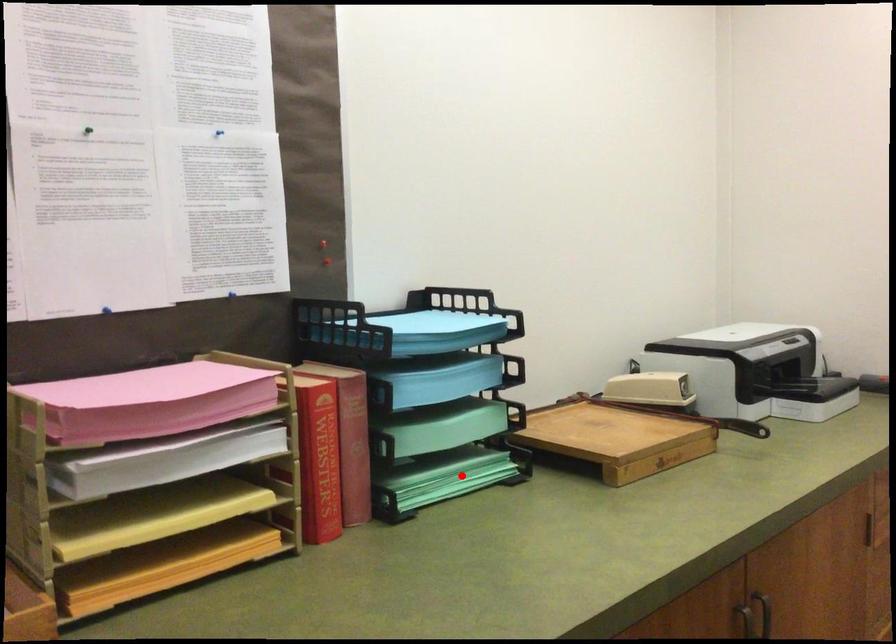
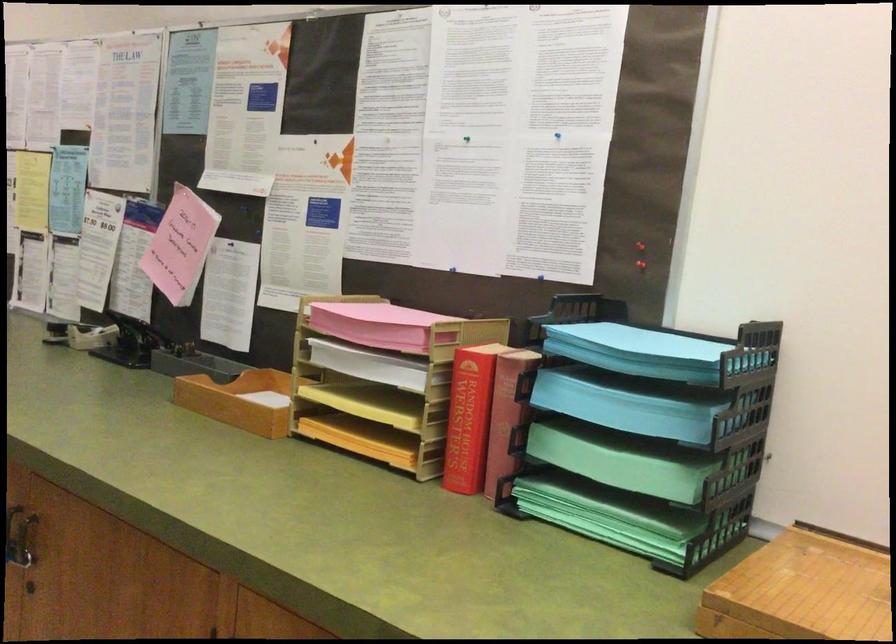
Where in the second image is the point corresponding to the highlighted location from the first image?

(605, 512)